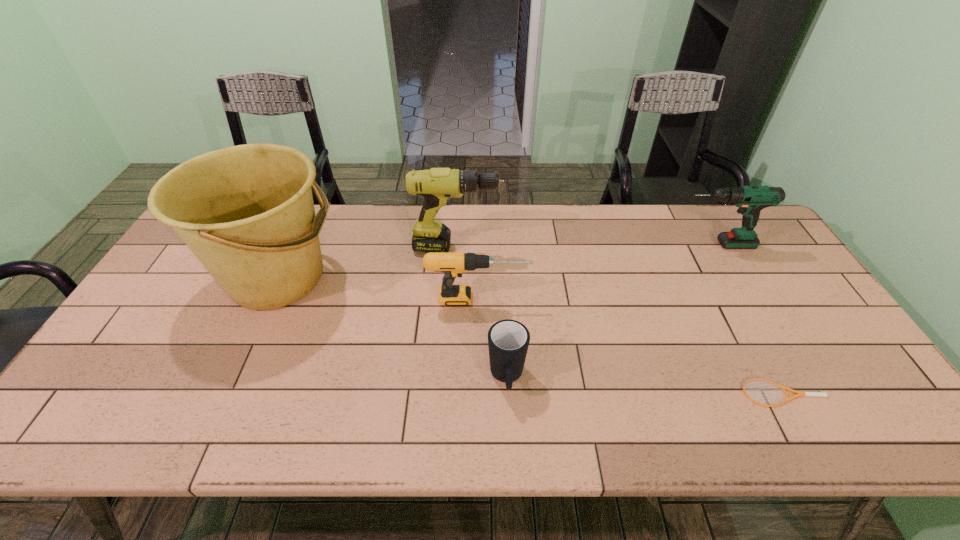
This screenshot has height=540, width=960. What are the coordinates of `vacant space located on the handle side of the fifth shortest object` in the screenshot? It's located at (589, 247).

Find the location of a particular element. The image size is (960, 540). free space located on the handle side of the rightmost drill is located at coordinates (660, 245).

Where is `free space located on the handle side of the rightmost drill`? The image size is (960, 540). free space located on the handle side of the rightmost drill is located at coordinates (660, 245).

This screenshot has width=960, height=540. In order to click on vacant space situated on the handle side of the rightmost drill in this screenshot , I will do `click(647, 245)`.

You are a GUI agent. You are given a task and a screenshot of the screen. Output one action in this format:
    pyautogui.click(x=<x>, y=<y>)
    Task: Click on the blank space located 0.200m on the handle side of the fourth tallest object
    The image size is (960, 540).
    Given the screenshot: What is the action you would take?
    pyautogui.click(x=601, y=299)

Find the location of a particular element. The image size is (960, 540). vacant space located 0.070m on the side of the fifth tallest object with the handle is located at coordinates (510, 433).

The width and height of the screenshot is (960, 540). Find the location of `free space located 0.050m on the right of the shortest object`. free space located 0.050m on the right of the shortest object is located at coordinates (845, 393).

This screenshot has width=960, height=540. Find the location of `bucket that is positioned at the far edge`. bucket that is positioned at the far edge is located at coordinates (247, 213).

You are a GUI agent. You are given a task and a screenshot of the screen. Output one action in this format:
    pyautogui.click(x=<x>, y=<y>)
    Task: Click on the object present at the near edge
    The height and width of the screenshot is (540, 960).
    Given the screenshot: What is the action you would take?
    pyautogui.click(x=783, y=388)

Where is `object that is positioned at the left edge`? This screenshot has width=960, height=540. object that is positioned at the left edge is located at coordinates (247, 213).